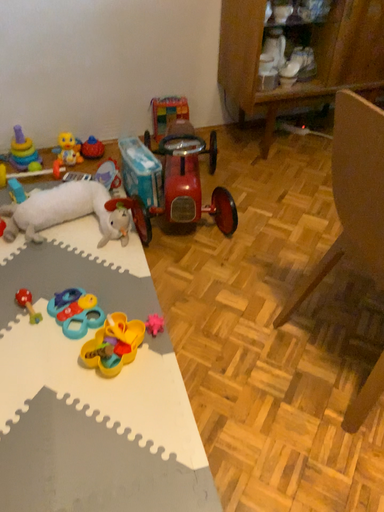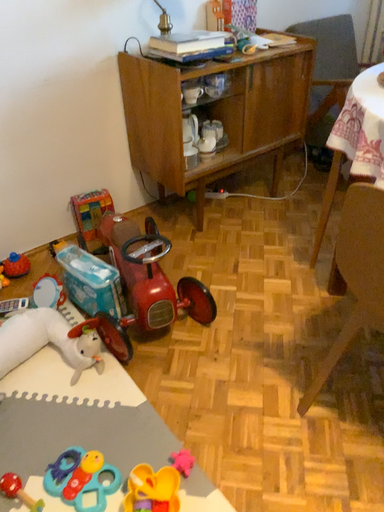
Question: How did the camera likely rotate when shooting the video?

Choices:
 (A) rotated downward
 (B) rotated upward

Answer: (B)